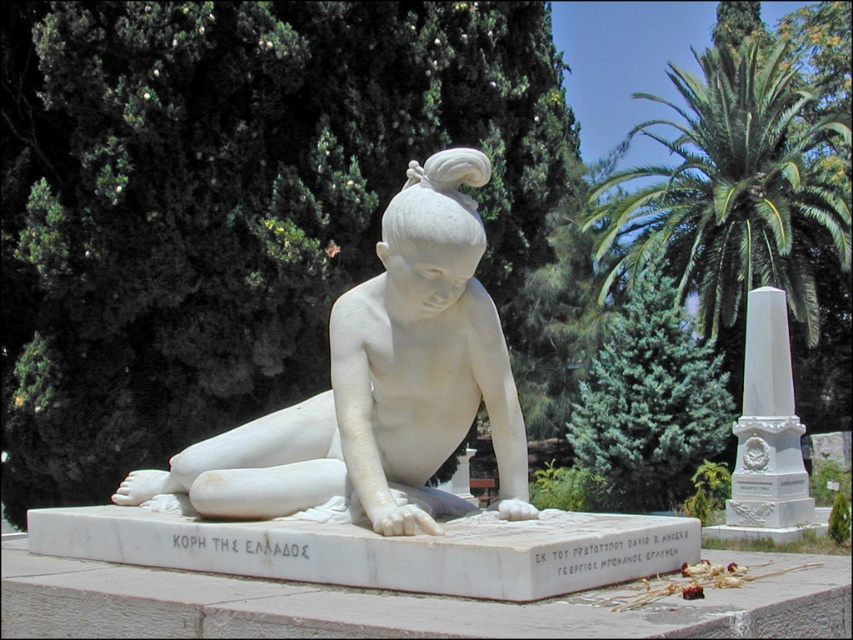
You are an art student analyzing the image. You notice the white marble statue at center and the green leafy palm at upper right. Based on their sizes in the image, which object would appear closer to the viewer?

The white marble statue at center has a smaller size compared to green leafy palm at upper right. Since objects closer to the viewer appear larger, the green leafy palm at upper right is closer to the viewer than the white marble statue at center.

You are a photographer standing at the camera position. You want to take a photo of the marble statue of a seated figure on the pedestal. However, there is a green leafy palm at upper right that might block the view. Can you determine if the palm will obstruct the statue in your photo?

The green leafy palm at upper right is 22.76 meters away from the camera. Since the statue is on a pedestal and the palm is at a significant distance, it is unlikely to obstruct the statue in the photo.

You are an art conservator tasked with moving the white marble statue at center and the white marble obelisk at right to a new exhibition space. The gallery has a 30 feet wide entrance. Can both objects be transported through the entrance simultaneously without rotating them?

The distance between the white marble statue at center and the white marble obelisk at right is 34.69 feet. Since the entrance is only 30 feet wide, they cannot be transported through the entrance simultaneously without rotating them as their combined width exceeds the entrance width.